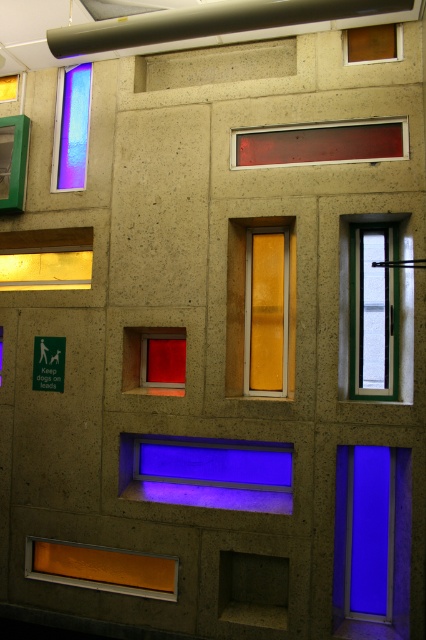
You are an architect designing a new building and want to ensure that the blue glass window at right and the matte red sign at upper center are visible from the entrance. Given their sizes, which one will appear larger when viewed from the entrance?

The blue glass window at right is taller than the matte red sign at upper center, so it will appear larger when viewed from the entrance.